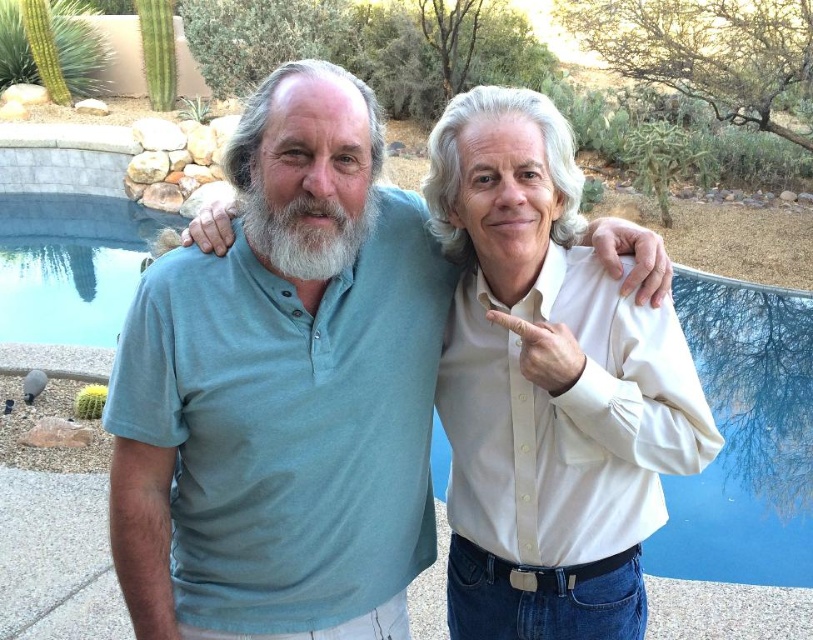
Question: Is matte green shirt at center bigger than white matte beard at center?

Choices:
 (A) yes
 (B) no

Answer: (A)

Question: Estimate the real-world distances between objects in this image. Which object is farther from the white glossy shirt at right?

Choices:
 (A) matte green shirt at center
 (B) white matte beard at center

Answer: (B)

Question: Which object appears farthest from the camera in this image?

Choices:
 (A) matte green shirt at center
 (B) white glossy shirt at right
 (C) white matte beard at center

Answer: (B)

Question: Is white glossy shirt at right thinner than white matte beard at center?

Choices:
 (A) no
 (B) yes

Answer: (A)

Question: Which point is closer to the camera?

Choices:
 (A) (546, 285)
 (B) (375, 483)

Answer: (A)

Question: Is white glossy shirt at right positioned at the back of white matte beard at center?

Choices:
 (A) no
 (B) yes

Answer: (B)